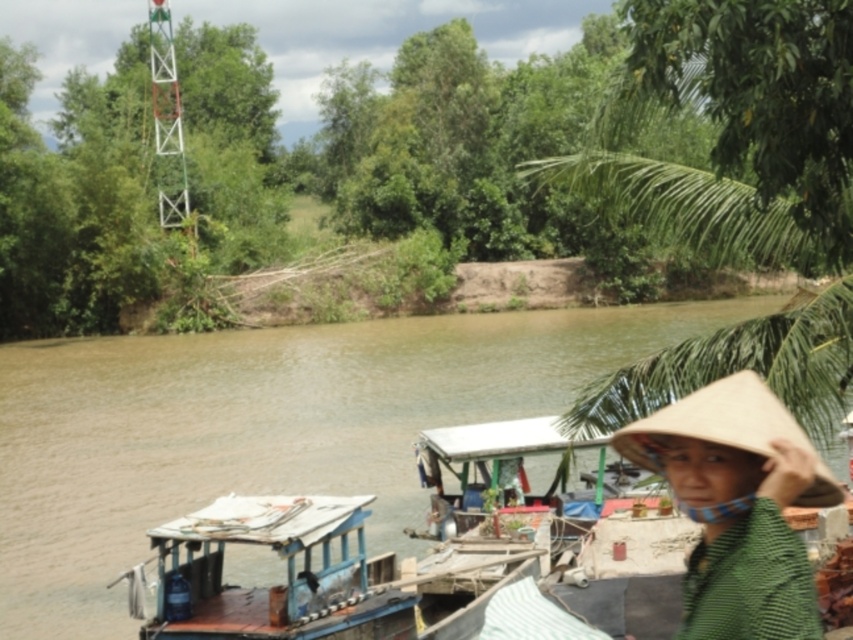
Question: In this image, where is wooden boat at center located relative to bleached straw hat at lower right?

Choices:
 (A) above
 (B) below

Answer: (B)

Question: Which of these objects is positioned closest to the wooden boat at center?

Choices:
 (A) brown muddy water at center
 (B) bleached straw hat at lower right

Answer: (B)

Question: Which object is closer to the camera taking this photo?

Choices:
 (A) bleached straw hat at lower right
 (B) wooden boat at center
 (C) brown muddy water at center

Answer: (A)

Question: Does wooden boat at center come in front of bleached straw hat at lower right?

Choices:
 (A) yes
 (B) no

Answer: (B)

Question: Is brown muddy water at center wider than bleached straw hat at lower right?

Choices:
 (A) yes
 (B) no

Answer: (A)

Question: Which object is farther from the camera taking this photo?

Choices:
 (A) brown muddy water at center
 (B) wooden boat at center
 (C) bleached straw hat at lower right

Answer: (B)